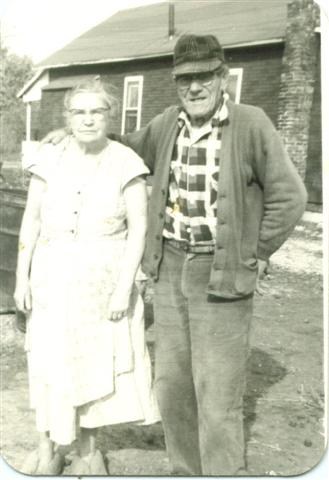
Where is `window`? The width and height of the screenshot is (329, 480). window is located at coordinates (134, 94), (132, 122), (231, 83).